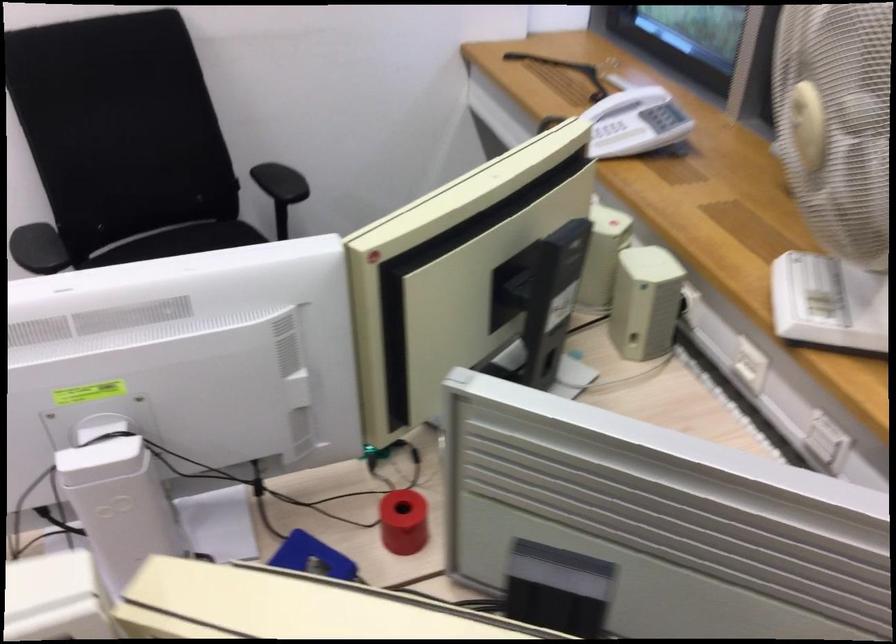
The height and width of the screenshot is (644, 896). Describe the element at coordinates (280, 182) in the screenshot. I see `the black chair armrest` at that location.